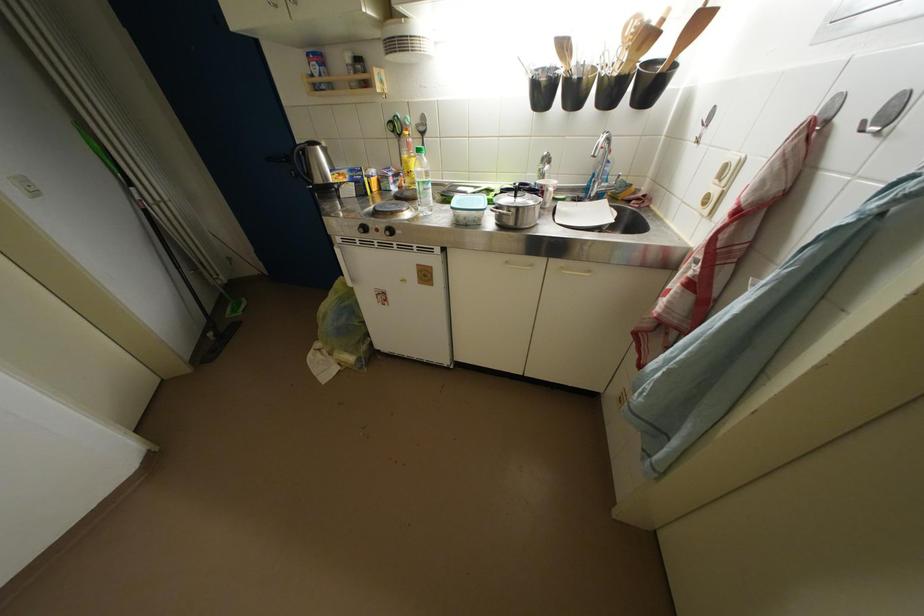
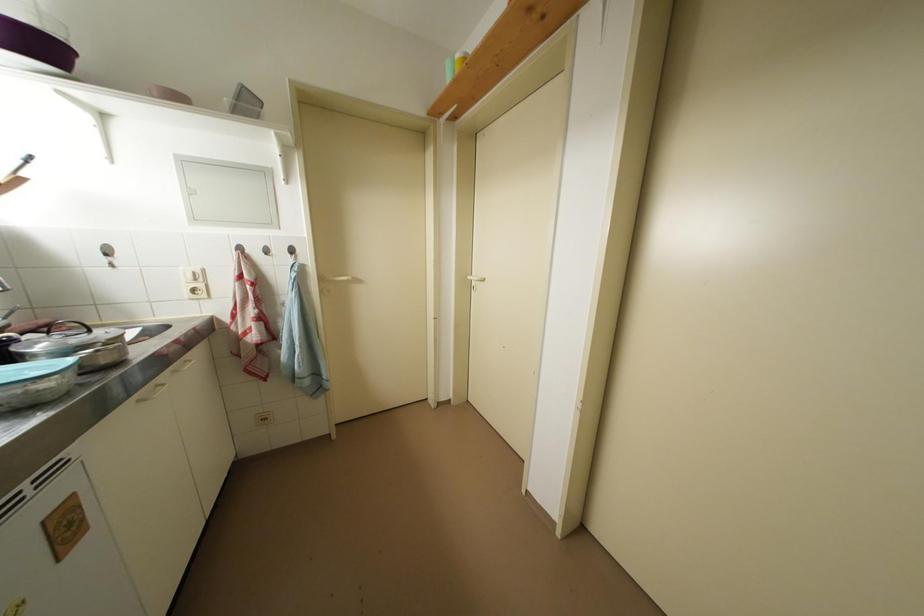
Where in the second image is the point corresponding to pixel 733 169 from the first image?

(201, 277)